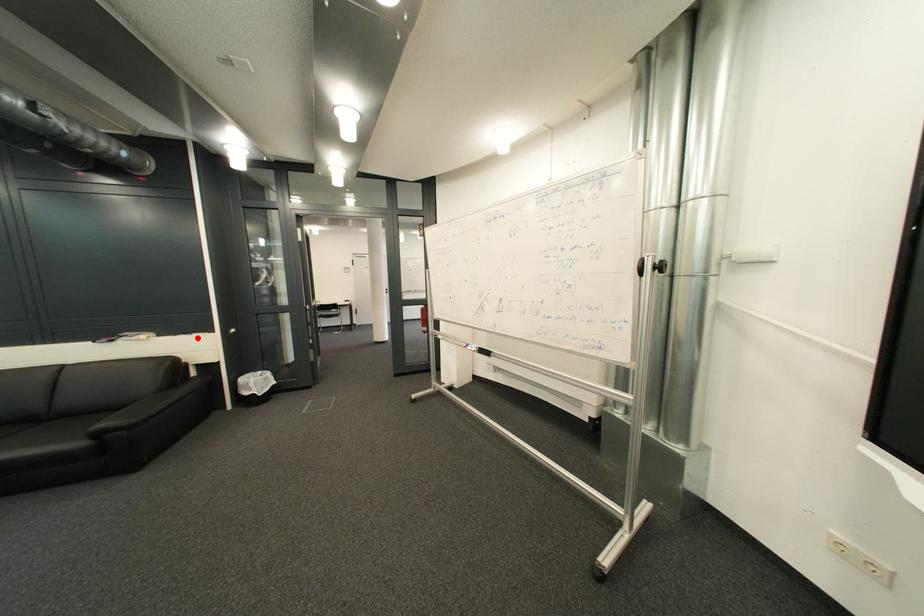
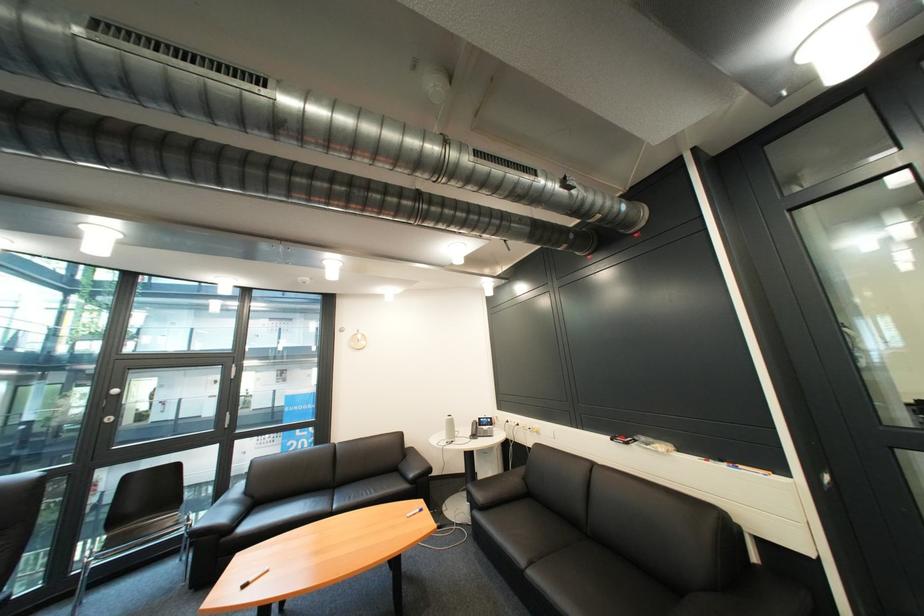
Locate, in the second image, the point that corresponds to the highlighted location in the first image.

(736, 468)